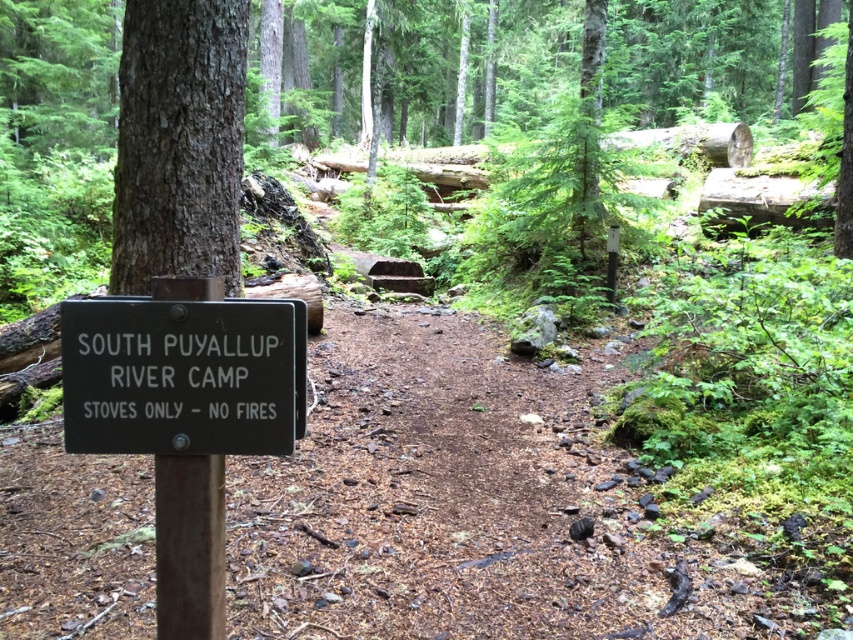
You are a hiker who wants to place a 1.5 meter wide tent between the black wood sign at left and the smooth brown tree trunk at upper left. Can the tent fit between them?

The black wood sign at left has a lesser width compared to smooth brown tree trunk at upper left. However, the description only provides information about the width comparison between the two objects, not the actual distance between them. Therefore, it is impossible to determine if the tent will fit based on the given information.

What object is located at the coordinates point (183, 376)?

The black wood sign at left is located at point (183, 376).

You are a hiker who wants to place a 1.2 meter long tent between the black wood sign at left and the smooth brown tree trunk at upper left. Can you fit the tent there based on their sizes?

The black wood sign at left is smaller than the smooth brown tree trunk at upper left, so the tent may not fit between them if the distance between them is less than 1.2 meters. However, the size comparison alone doesn not provide enough information about the actual spacing between the objects.